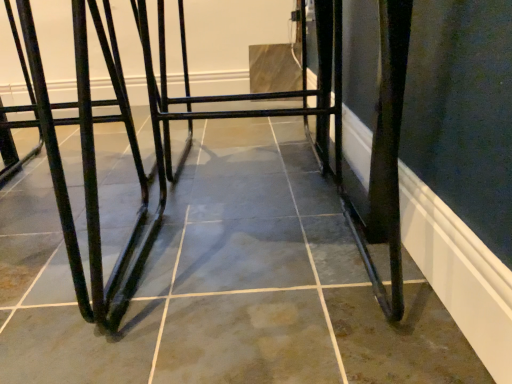
Question: Is black metal table at center facing away from matte black metal bar stool at left?

Choices:
 (A) yes
 (B) no

Answer: (B)

Question: Is black metal table at center smaller than matte black metal bar stool at left?

Choices:
 (A) no
 (B) yes

Answer: (A)

Question: Are black metal table at center and matte black metal bar stool at left far apart?

Choices:
 (A) yes
 (B) no

Answer: (B)

Question: Considering the relative sizes of black metal table at center and matte black metal bar stool at left in the image provided, is black metal table at center taller than matte black metal bar stool at left?

Choices:
 (A) no
 (B) yes

Answer: (A)

Question: Is black metal table at center not within matte black metal bar stool at left?

Choices:
 (A) yes
 (B) no

Answer: (A)

Question: From a real-world perspective, does black metal table at center sit lower than matte black metal bar stool at left?

Choices:
 (A) yes
 (B) no

Answer: (B)

Question: Is matte black metal bar stool at left looking in the opposite direction of black metal table at center?

Choices:
 (A) no
 (B) yes

Answer: (A)

Question: Is matte black metal bar stool at left outside black metal table at center?

Choices:
 (A) no
 (B) yes

Answer: (B)

Question: From the image's perspective, is matte black metal bar stool at left on top of black metal table at center?

Choices:
 (A) yes
 (B) no

Answer: (B)

Question: From a real-world perspective, is matte black metal bar stool at left under black metal table at center?

Choices:
 (A) no
 (B) yes

Answer: (B)

Question: Is the depth of matte black metal bar stool at left greater than that of black metal table at center?

Choices:
 (A) yes
 (B) no

Answer: (A)

Question: Considering the relative sizes of matte black metal bar stool at left and black metal table at center in the image provided, is matte black metal bar stool at left smaller than black metal table at center?

Choices:
 (A) no
 (B) yes

Answer: (B)

Question: Is black metal table at center spatially inside matte black metal bar stool at left, or outside of it?

Choices:
 (A) inside
 (B) outside

Answer: (B)